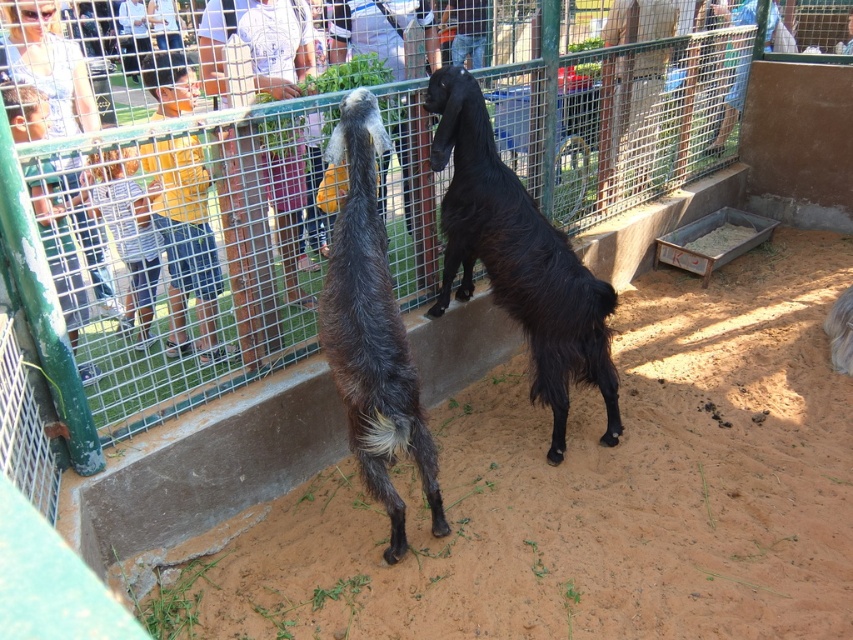
Who is shorter, brown sandy dirt at center or black shaggy goat at center?

With less height is brown sandy dirt at center.

Identify the location of brown sandy dirt at center. (590, 492).

The height and width of the screenshot is (640, 853). I want to click on brown sandy dirt at center, so click(590, 492).

Is brown sandy dirt at center to the right of dark brown fur goat at center from the viewer's perspective?

Yes, brown sandy dirt at center is to the right of dark brown fur goat at center.

What do you see at coordinates (590, 492) in the screenshot? The width and height of the screenshot is (853, 640). I see `brown sandy dirt at center` at bounding box center [590, 492].

The width and height of the screenshot is (853, 640). In order to click on brown sandy dirt at center in this screenshot , I will do `click(590, 492)`.

Based on the photo, is the position of black shaggy goat at center more distant than that of dark brown fur goat at center?

Yes, it is.

Is black shaggy goat at center in front of dark brown fur goat at center?

No, black shaggy goat at center is further to the viewer.

Measure the distance between point (479, 221) and camera.

The distance of point (479, 221) from camera is 3.05 meters.

Where is `black shaggy goat at center`? black shaggy goat at center is located at coordinates (518, 259).